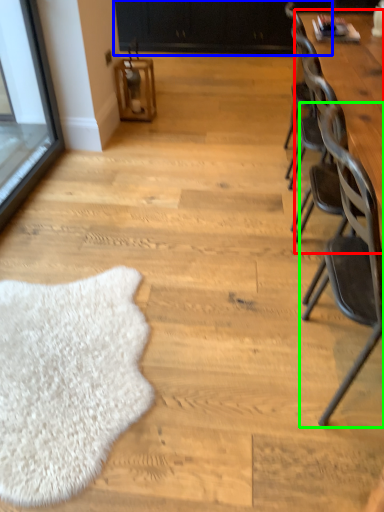
Question: Considering the real-world distances, which object is closest to table (highlighted by a red box)? dresser (highlighted by a blue box) or chair (highlighted by a green box).

Choices:
 (A) dresser
 (B) chair

Answer: (B)